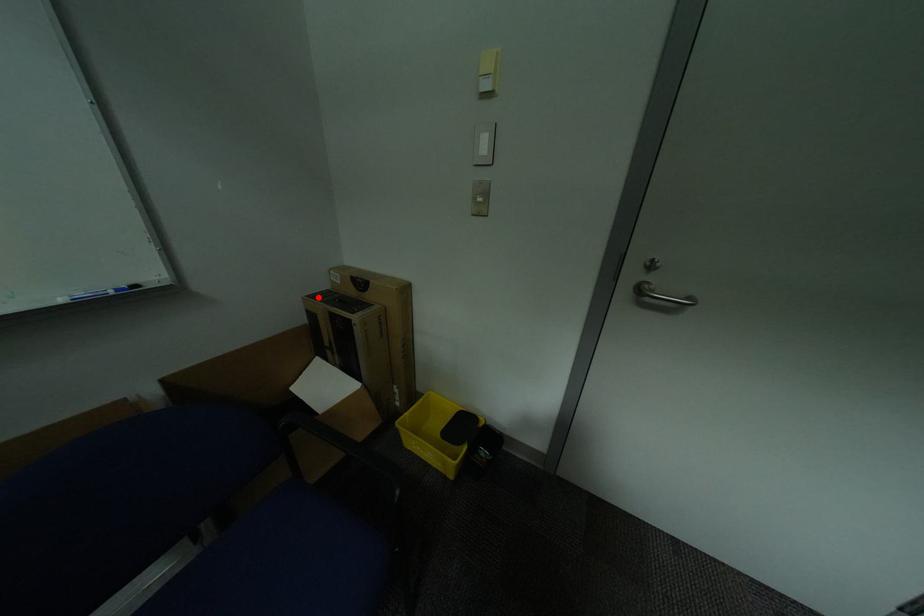
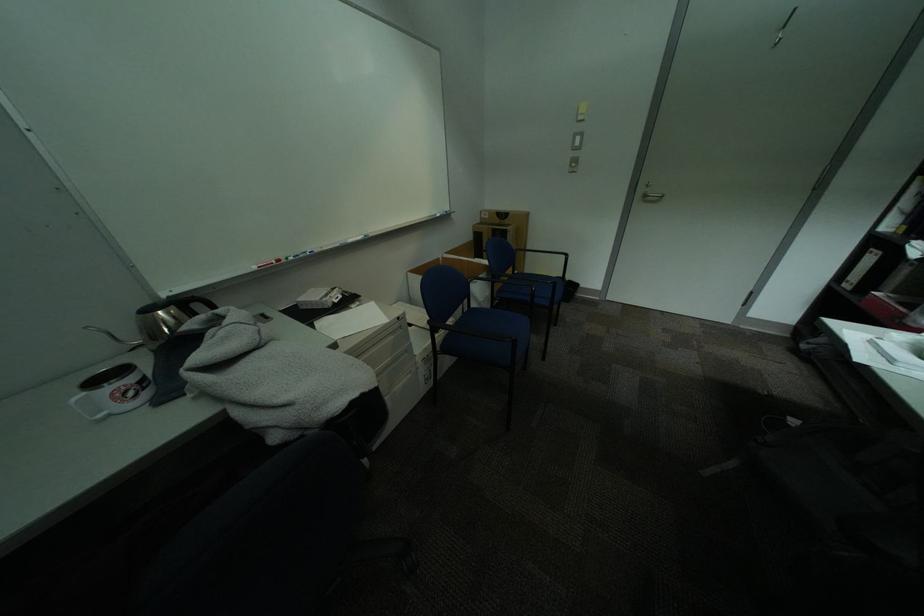
Question: I am providing you with two images of the same scene from different viewpoints. A red point is shown in image1. For the corresponding object point in image2, is it positioned nearer or farther from the camera?

Choices:
 (A) Nearer
 (B) Farther

Answer: (A)